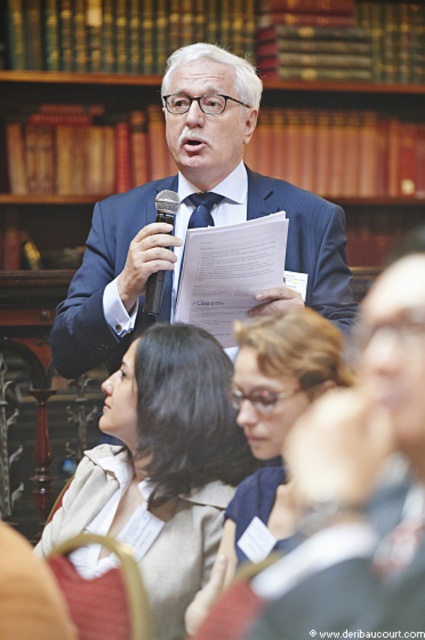
You are organizing a conference and need to place the black plastic microphone at upper center and the blue silk tie at center on a table. If the table has limited space, which object should you prioritize placing first?

The black plastic microphone at upper center should be placed first since it occupies less space than the blue silk tie at center, allowing more room for the larger item afterward.

You are an event planner trying to set up a podium for a speaker. The podium has a stand for the microphone and a place to pin the speaker. Based on the image, should you position the stand for the black plastic microphone at upper center above or below the area where the blue silk tie at center will be?

The black plastic microphone at upper center is positioned over the blue silk tie at center, so you should position the stand above the area where the blue silk tie at center will be.

You are a photographer standing at the back of the room. You want to take a closeup photo of the speaker. The camera can only focus on objects within 35 inches. Will the matte blue shirt at center and blue silk tie at center both be in focus?

The matte blue shirt at center is 37.58 inches away from blue silk tie at center. Since the camera can only focus on objects within 35 inches, the distance between them exceeds the focus range. Therefore, both items cannot be in focus simultaneously.